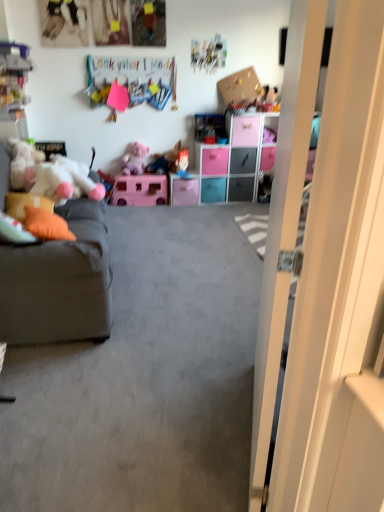
Image resolution: width=384 pixels, height=512 pixels. What do you see at coordinates (165, 161) in the screenshot?
I see `pink plastic toy car at center, placed as the 3th toy when sorted from left to right` at bounding box center [165, 161].

The height and width of the screenshot is (512, 384). In order to click on pink plastic toy car at center, which ranks as the third toy in right-to-left order in this screenshot , I will do `click(165, 161)`.

Where is `blue plastic drawer at center, which is the 5th drawer from right to left`? The width and height of the screenshot is (384, 512). blue plastic drawer at center, which is the 5th drawer from right to left is located at coordinates (213, 190).

This screenshot has width=384, height=512. What do you see at coordinates (135, 159) in the screenshot?
I see `plush pink teddy bear at center, arranged as the second toy when viewed from the front` at bounding box center [135, 159].

What are the coordinates of `gray carpet at center` in the screenshot? It's located at (144, 378).

Locate an element on the screen. This screenshot has height=512, width=384. pink plastic drawer at center, marked as the fourth drawer in a right-to-left arrangement is located at coordinates (215, 161).

Where is `pink plastic toy car at center, placed as the 3th toy when sorted from left to right`? This screenshot has width=384, height=512. pink plastic toy car at center, placed as the 3th toy when sorted from left to right is located at coordinates (165, 161).

Is point (353, 271) positioned behind point (46, 222)?

No, it is not.

Which is behind, white glossy door at right or orange fabric pillow at left, arranged as the 2th pillow when viewed from the left?

orange fabric pillow at left, arranged as the 2th pillow when viewed from the left, is more distant.

Considering the positions of objects white glossy door at right and orange fabric pillow at left, arranged as the 2th pillow when viewed from the left, in the image provided, who is more to the left, white glossy door at right or orange fabric pillow at left, arranged as the 2th pillow when viewed from the left,?

orange fabric pillow at left, arranged as the 2th pillow when viewed from the left, is more to the left.

In the scene shown: Are white glossy door at right and orange fabric pillow at left, which appears as the first pillow when viewed from the right, far apart?

That's right, there is a large distance between white glossy door at right and orange fabric pillow at left, which appears as the first pillow when viewed from the right.

How far apart are plush mickey mouse at upper right, which is counted as the first toy, starting from the back, and white glossy door at right?

12.25 feet.

From the image's perspective, does plush mickey mouse at upper right, which is counted as the first toy, starting from the back, appear higher than white glossy door at right?

Yes.

Considering the relative positions of plush mickey mouse at upper right, which ranks as the first toy in right-to-left order, and white glossy door at right in the image provided, is plush mickey mouse at upper right, which ranks as the first toy in right-to-left order, to the left or to the right of white glossy door at right?

Based on their positions, plush mickey mouse at upper right, which ranks as the first toy in right-to-left order, is located to the right of white glossy door at right.

Can you confirm if plush mickey mouse at upper right, which is counted as the first toy, starting from the back, is taller than white glossy door at right?

In fact, plush mickey mouse at upper right, which is counted as the first toy, starting from the back, may be shorter than white glossy door at right.

How different are the orientations of gray carpet at center and gray fabric couch at left in degrees?

gray carpet at center and gray fabric couch at left are facing 0.73 degrees away from each other.

From a real-world perspective, is gray carpet at center on gray fabric couch at left?

No, from a real-world perspective, gray carpet at center is not on top of gray fabric couch at left.

Is gray carpet at center aimed at gray fabric couch at left?

A: No, gray carpet at center does not turn towards gray fabric couch at left.

The image size is (384, 512). I want to click on studio couch above the gray carpet at center (from a real-world perspective), so click(59, 283).

From a real-world perspective, which is physically below, white glossy door at right or gray carpet at center?

From a 3D spatial view, gray carpet at center is below.

Considering the relative sizes of white glossy door at right and gray carpet at center in the image provided, is white glossy door at right bigger than gray carpet at center?

Actually, white glossy door at right might be smaller than gray carpet at center.

Is white glossy door at right positioned beyond the bounds of gray carpet at center?

white glossy door at right is positioned outside gray carpet at center.

Does point (333, 263) lie in front of point (164, 255)?

That is True.

Based on the photo, from a real-world perspective, is blue plastic drawer at center, the 2th drawer when ordered from left to right, beneath plush mickey mouse at upper right, the fifth toy when ordered from front to back?

Yes.

Is blue plastic drawer at center, the 2th drawer when ordered from left to right, beside plush mickey mouse at upper right, marked as the fifth toy in a left-to-right arrangement?

No, blue plastic drawer at center, the 2th drawer when ordered from left to right, is not with plush mickey mouse at upper right, marked as the fifth toy in a left-to-right arrangement.

Is blue plastic drawer at center, the 2th drawer when ordered from left to right, closer to the viewer compared to plush mickey mouse at upper right, marked as the fifth toy in a left-to-right arrangement?

No, it is not.

Is blue plastic drawer at center, the 2th drawer when ordered from left to right, inside or outside of plush mickey mouse at upper right, marked as the fifth toy in a left-to-right arrangement?

blue plastic drawer at center, the 2th drawer when ordered from left to right, is not enclosed by plush mickey mouse at upper right, marked as the fifth toy in a left-to-right arrangement.

Does white plush toy at left, arranged as the 1th toy when viewed from the front, have a lesser width compared to pink plastic toy car at center, which ranks as the third toy in right-to-left order?

Incorrect, the width of white plush toy at left, arranged as the 1th toy when viewed from the front, is not less than that of pink plastic toy car at center, which ranks as the third toy in right-to-left order.

Based on the photo, is white plush toy at left, the 5th toy when ordered from back to front, to the right of pink plastic toy car at center, placed as the third toy when sorted from front to back, from the viewer's perspective?

No, white plush toy at left, the 5th toy when ordered from back to front, is not to the right of pink plastic toy car at center, placed as the third toy when sorted from front to back.

From a real-world perspective, is white plush toy at left, arranged as the 1th toy when viewed from the front, under pink plastic toy car at center, which ranks as the third toy in right-to-left order?

Incorrect, from a real-world perspective, white plush toy at left, arranged as the 1th toy when viewed from the front, is higher than pink plastic toy car at center, which ranks as the third toy in right-to-left order.

From the picture: Is white plush toy at left, arranged as the 1th toy when viewed from the front, next to pink plastic toy car at center, the third toy from the back, and touching it?

No, white plush toy at left, arranged as the 1th toy when viewed from the front, is not with pink plastic toy car at center, the third toy from the back.

Is point (245, 142) positioned after point (177, 192)?

No, it is in front of (177, 192).

From a real-world perspective, between pink plastic drawer at center, marked as the 6th drawer in a left-to-right arrangement, and pink plastic drawer at center, arranged as the first drawer when viewed from the left, who is vertically lower?

pink plastic drawer at center, arranged as the first drawer when viewed from the left, from a real-world perspective.

Is pink plastic drawer at center, marked as the 6th drawer in a left-to-right arrangement, placed right next to pink plastic drawer at center, arranged as the first drawer when viewed from the left?

No, pink plastic drawer at center, marked as the 6th drawer in a left-to-right arrangement, is not with pink plastic drawer at center, arranged as the first drawer when viewed from the left.

Can you tell me how much pink plastic drawer at center, arranged as the first drawer when viewed from the right, and pink plastic drawer at center, arranged as the first drawer when viewed from the left, differ in facing direction?

There is a 9.33e-05-degree angle between the facing directions of pink plastic drawer at center, arranged as the first drawer when viewed from the right, and pink plastic drawer at center, arranged as the first drawer when viewed from the left.

At what (x,y) coordinates should I click in order to perform the action: click on door on the right of orange fabric pillow at left, which appears as the first pillow when viewed from the right. Please return your answer as a coordinate pair (x, y). Image resolution: width=384 pixels, height=512 pixels. Looking at the image, I should click on (339, 289).

Image resolution: width=384 pixels, height=512 pixels. Identify the location of door that appears in front of the plush mickey mouse at upper right, which is counted as the first toy, starting from the back. (339, 289).

Based on their spatial positions, is metallic gray drawer at center, placed as the second drawer when sorted from right to left, or plush pink teddy bear at center, placed as the 2th toy when sorted from left to right, further from gray fabric couch at left?

Among the two, metallic gray drawer at center, placed as the second drawer when sorted from right to left, is located further to gray fabric couch at left.

From the image, which object appears to be farther from gray fabric couch at left, white glossy door at right or pink matte toy car at center?

pink matte toy car at center is positioned further to the anchor gray fabric couch at left.

Looking at the image, which one is located further to pink plastic storage unit at center, pink plastic drawer at center, arranged as the first drawer when viewed from the left, or gray fabric couch at left?

gray fabric couch at left lies further to pink plastic storage unit at center than the other object.

From the image, which object appears to be farther from gray carpet at center, pink plastic toy car at center, the third toy from the back, or black plastic drawer at center, the 3th drawer when ordered from right to left?

black plastic drawer at center, the 3th drawer when ordered from right to left, is positioned further to the anchor gray carpet at center.

Considering their positions, is metallic gray drawer at center, placed as the second drawer when sorted from right to left, positioned further to gray fabric couch at left than white matte hand at center, arranged as the second toy when viewed from the back?

metallic gray drawer at center, placed as the second drawer when sorted from right to left.

Which object lies further to the anchor point white plush toy at left, arranged as the 1th toy when viewed from the front, black plastic drawer at center, positioned as the 4th drawer in left-to-right order, or blue plastic drawer at center, the 2th drawer when ordered from left to right?

Based on the image, black plastic drawer at center, positioned as the 4th drawer in left-to-right order, appears to be further to white plush toy at left, arranged as the 1th toy when viewed from the front.

Estimate the real-world distances between objects in this image. Which object is further from white plush toy at left, the 5th toy when ordered from back to front, metallic gray drawer at center, placed as the second drawer when sorted from right to left, or white glossy door at right?

Based on the image, white glossy door at right appears to be further to white plush toy at left, the 5th toy when ordered from back to front.

Looking at the image, which one is located further to orange fabric pillow at left, which ranks as the 2th pillow in right-to-left order, pink plastic drawer at center, arranged as the first drawer when viewed from the right, or plush pink teddy bear at center, placed as the 2th toy when sorted from left to right?

pink plastic drawer at center, arranged as the first drawer when viewed from the right, is further to orange fabric pillow at left, which ranks as the 2th pillow in right-to-left order.

Image resolution: width=384 pixels, height=512 pixels. I want to click on entertainment center between orange fabric pillow at left, arranged as the 2th pillow when viewed from the left, and pink plastic drawer at center, marked as the 6th drawer in a right-to-left arrangement, in the front-back direction, so click(x=236, y=160).

Locate an element on the screen. entertainment center between white glossy door at right and pink matte toy car at center in the front-back direction is located at coordinates (236, 160).

I want to click on toy between white glossy door at right and plush pink teddy bear at center, arranged as the second toy when viewed from the front, from front to back, so click(x=50, y=175).

Image resolution: width=384 pixels, height=512 pixels. I want to click on studio couch between gray carpet at center and pink matte toy car at center along the z-axis, so click(x=59, y=283).